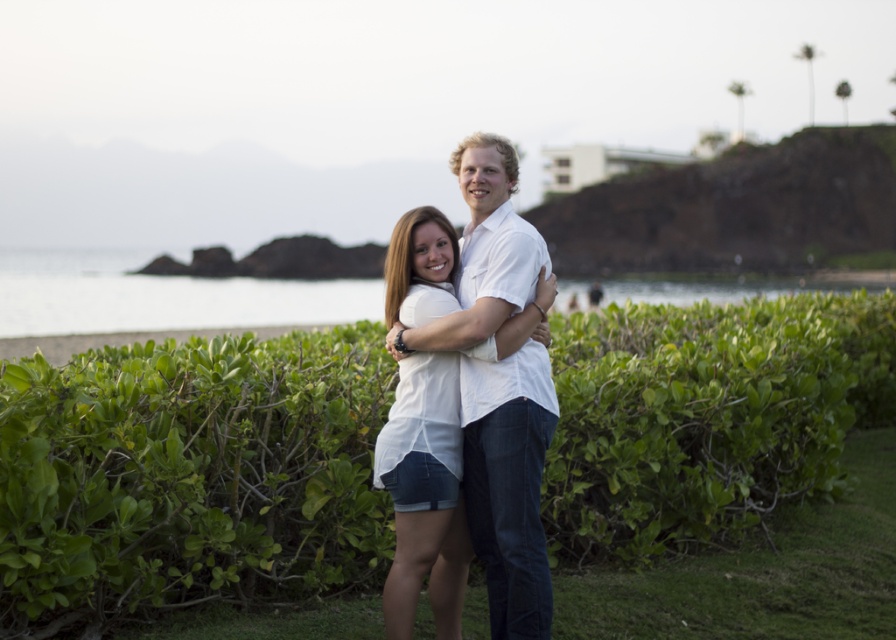
Question: Which point appears farthest from the camera in this image?

Choices:
 (A) (513, 456)
 (B) (73, 444)

Answer: (B)

Question: Does green leafy hedge at center come behind white cotton shirt at center?

Choices:
 (A) yes
 (B) no

Answer: (B)

Question: Is green leafy hedge at center further to camera compared to white cotton shirt at center?

Choices:
 (A) no
 (B) yes

Answer: (A)

Question: Is green leafy hedge at center above white cotton shirt at center?

Choices:
 (A) no
 (B) yes

Answer: (A)